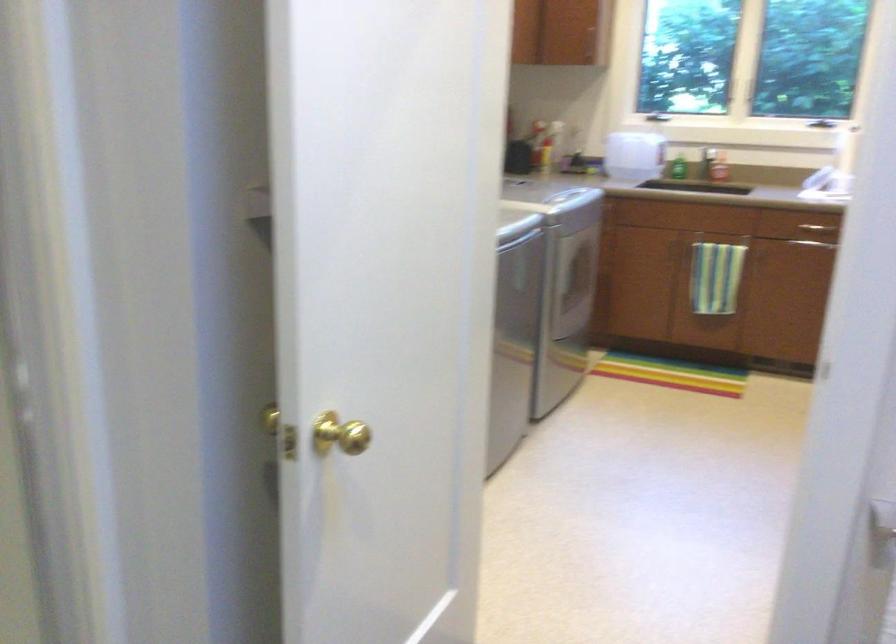
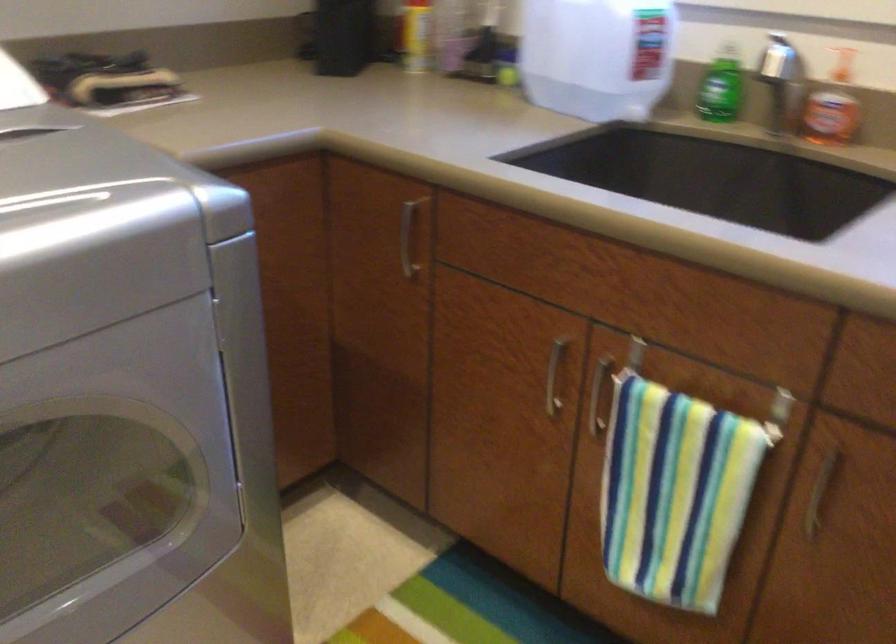
Where in the second image is the point corresponding to (720,162) from the first image?

(832, 106)